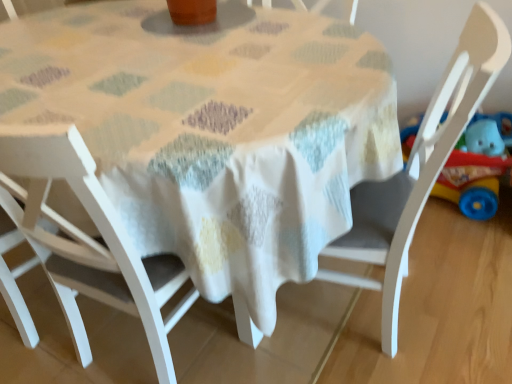
Question: Considering the positions of rubberized plastic toy car at right and white wood chair at center, marked as the 3th chair in a left-to-right arrangement, in the image, is rubberized plastic toy car at right wider or thinner than white wood chair at center, marked as the 3th chair in a left-to-right arrangement,?

Choices:
 (A) wide
 (B) thin

Answer: (B)

Question: Considering the positions of rubberized plastic toy car at right and white wood chair at center, marked as the 3th chair in a left-to-right arrangement, in the image, is rubberized plastic toy car at right bigger or smaller than white wood chair at center, marked as the 3th chair in a left-to-right arrangement,?

Choices:
 (A) small
 (B) big

Answer: (A)

Question: Which object is positioned closest to the white fabric table at center?

Choices:
 (A) white wood chair at center, marked as the 3th chair in a left-to-right arrangement
 (B) white wood chair at center, which ranks as the second chair in left-to-right order
 (C) white wood chair at lower left, the first chair from the left
 (D) rubberized plastic toy car at right

Answer: (B)

Question: Considering the real-world distances, which object is farthest from the white fabric table at center?

Choices:
 (A) white wood chair at lower left, which appears as the 3th chair when viewed from the right
 (B) rubberized plastic toy car at right
 (C) white wood chair at center, marked as the 3th chair in a left-to-right arrangement
 (D) white wood chair at center, marked as the 2th chair in a right-to-left arrangement

Answer: (B)